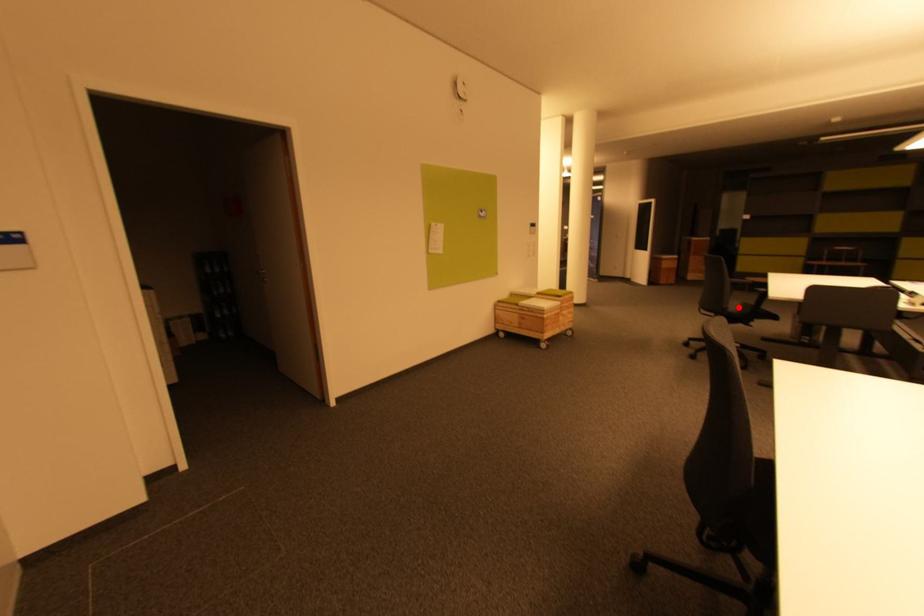
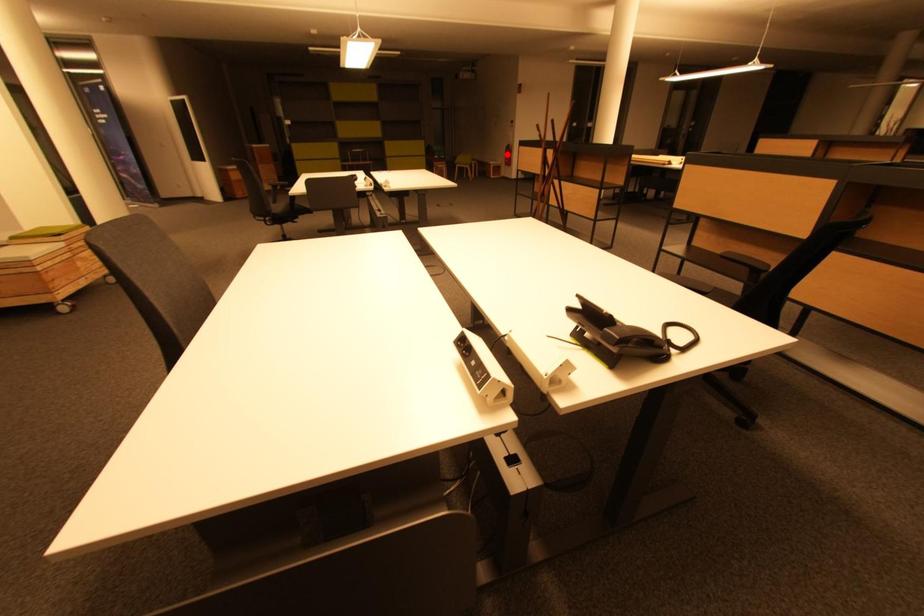
I am providing you with two images of the same scene from different viewpoints. A red point is marked on the first image and another point is marked on the second image. Are the points marked in image1 and image2 representing the same 3D position?

No